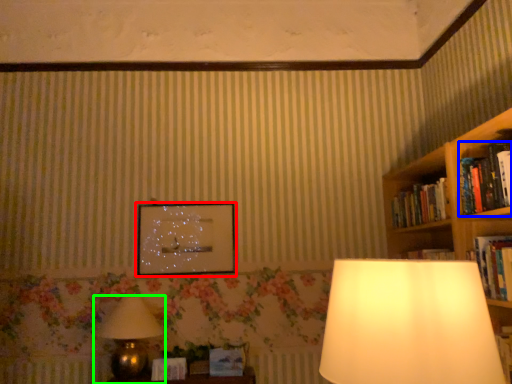
Question: Which object is the farthest from picture frame (highlighted by a red box)? Choose among these: book (highlighted by a blue box) or lamp (highlighted by a green box).

Choices:
 (A) book
 (B) lamp

Answer: (A)